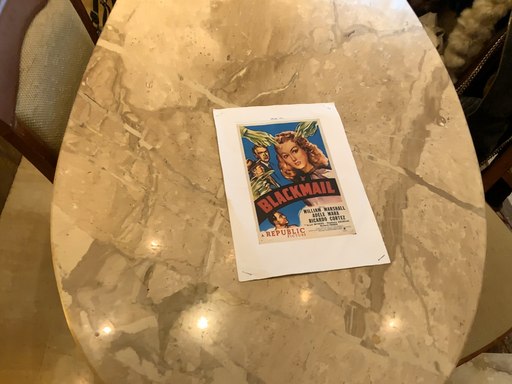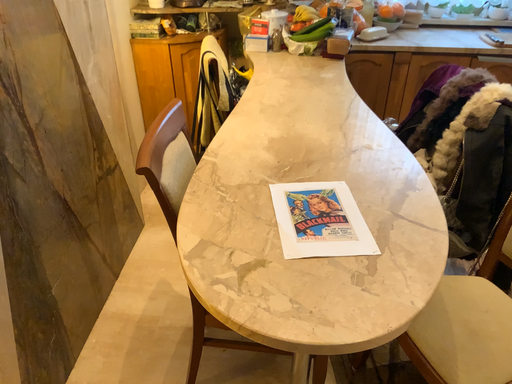
Question: How did the camera likely rotate when shooting the video?

Choices:
 (A) rotated downward
 (B) rotated upward

Answer: (B)